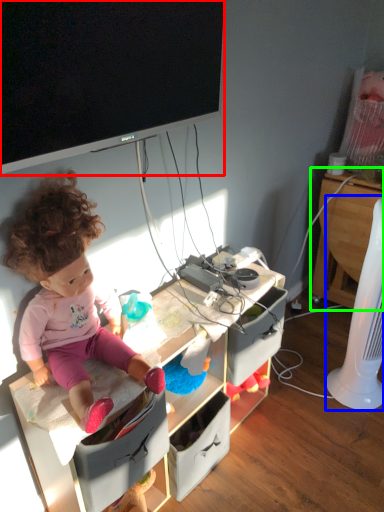
Question: Which is farther away from television (highlighted by a red box)? fan (highlighted by a blue box) or computer desk (highlighted by a green box)?

Choices:
 (A) fan
 (B) computer desk

Answer: (B)